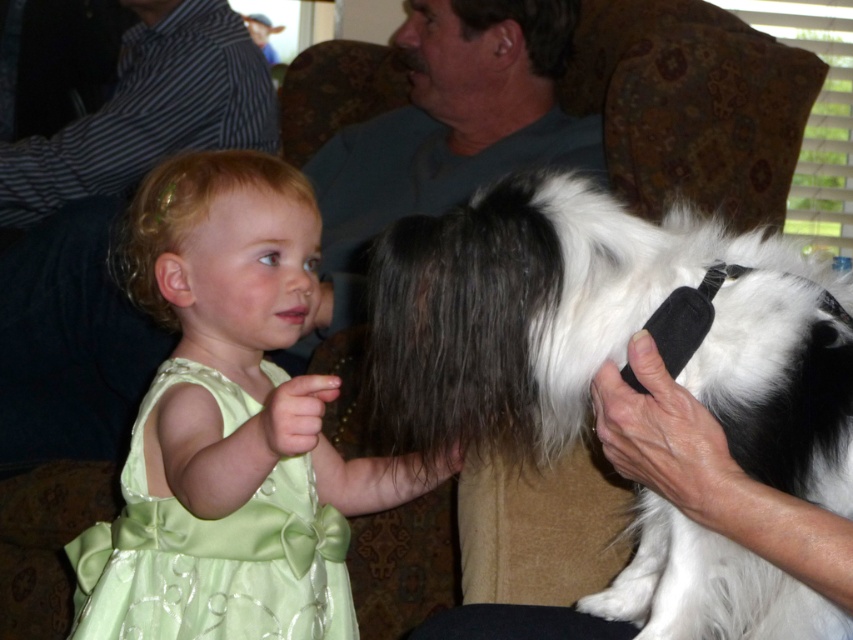
Question: Is black and white fur at center thinner than satin green dress at center?

Choices:
 (A) yes
 (B) no

Answer: (B)

Question: Does green satin dress at center come in front of satin green dress at center?

Choices:
 (A) no
 (B) yes

Answer: (B)

Question: Which point is farther from the camera taking this photo?

Choices:
 (A) (640, 557)
 (B) (274, 380)

Answer: (B)

Question: Which of the following is the closest to the observer?

Choices:
 (A) (229, 152)
 (B) (538, 342)
 (C) (94, 525)

Answer: (B)

Question: Is black and white fur at center bigger than green satin dress at center?

Choices:
 (A) yes
 (B) no

Answer: (B)

Question: Which point is farther to the camera?

Choices:
 (A) (317, 532)
 (B) (311, 620)
 (C) (434, 390)

Answer: (A)